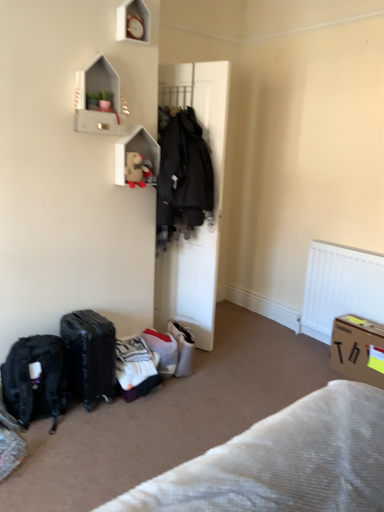
Question: From the image's perspective, is fluffy beige plush at upper center located above or below black matte backpack at lower left?

Choices:
 (A) above
 (B) below

Answer: (A)

Question: Based on their positions, is fluffy beige plush at upper center located to the left or right of black matte backpack at lower left?

Choices:
 (A) left
 (B) right

Answer: (B)

Question: Which object is positioned farthest from the cardboard box at lower right?

Choices:
 (A) black matte suitcase at lower left
 (B) white textured blanket at lower right
 (C) fluffy beige plush at upper center
 (D) white matte door at center
 (E) concrete textured shelf at upper left

Answer: (E)

Question: Estimate the real-world distances between objects in this image. Which object is farther from the white matte door at center?

Choices:
 (A) white matte wooden shelf at upper center, the first shelf ordered from the bottom
 (B) black matte backpack at lower left
 (C) black matte suitcase at lower left
 (D) concrete textured shelf at upper left
 (E) cardboard box at lower right

Answer: (B)